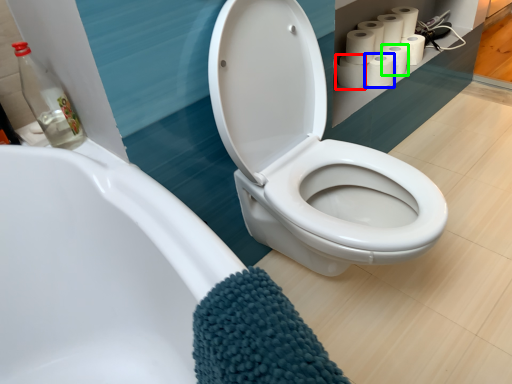
Question: Which is nearer to the toilet paper (highlighted by a red box)? toilet paper (highlighted by a blue box) or toilet paper (highlighted by a green box).

Choices:
 (A) toilet paper
 (B) toilet paper

Answer: (A)